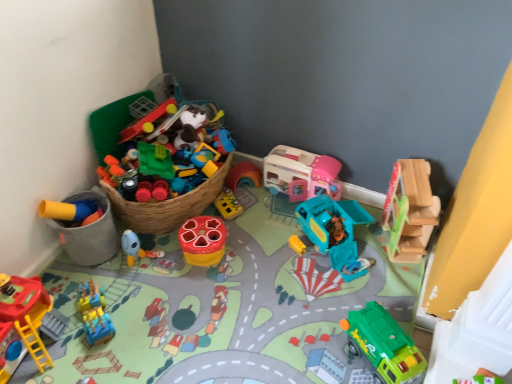
Where is `unoccupied space behind green matte truck at lower right, arranged as the second toy when viewed from the right`? The width and height of the screenshot is (512, 384). unoccupied space behind green matte truck at lower right, arranged as the second toy when viewed from the right is located at coordinates (366, 299).